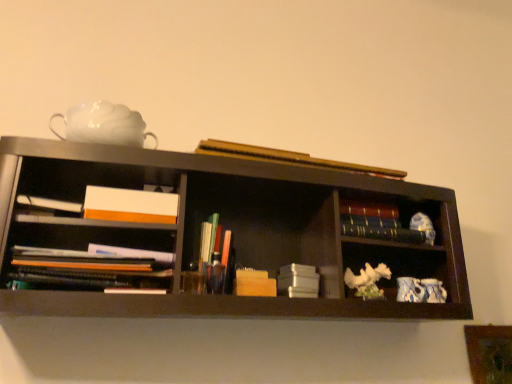
The width and height of the screenshot is (512, 384). What do you see at coordinates (388, 233) in the screenshot?
I see `dark blue hardcover book at center right, placed as the 6th book when sorted from left to right` at bounding box center [388, 233].

The width and height of the screenshot is (512, 384). Identify the location of wooden picture frame at lower right. (489, 353).

This screenshot has width=512, height=384. Describe the element at coordinates (489, 353) in the screenshot. I see `wooden picture frame at lower right` at that location.

Find the location of a particular element. blue and white porcelain teapot at lower right is located at coordinates (420, 290).

Measure the distance between blue and white porcelain teapot at lower right and camera.

blue and white porcelain teapot at lower right and camera are 4.10 feet apart from each other.

What is the approximate width of hardcover book at upper center, which is the 2th book in right-to-left order?

The width of hardcover book at upper center, which is the 2th book in right-to-left order, is 3.11 inches.

Measure the distance between white matte teapot at upper left and camera.

The distance of white matte teapot at upper left from camera is 3.66 feet.

Describe the element at coordinates (213, 254) in the screenshot. I see `matte plastic pens at center, arranged as the 2th book when viewed from the left` at that location.

Based on the photo, how much space does matte plastic pens at center, arranged as the 2th book when viewed from the left, occupy horizontally?

The width of matte plastic pens at center, arranged as the 2th book when viewed from the left, is 2.94 inches.

Identify the location of dark blue hardcover book at center right, acting as the first book starting from the right. This screenshot has width=512, height=384. (388, 233).

Are hardcover book at upper center, which is the 2th book in right-to-left order, and wooden picture frame at lower right beside each other?

No, hardcover book at upper center, which is the 2th book in right-to-left order, is not touching wooden picture frame at lower right.

How many degrees apart are the facing directions of hardcover book at upper center, which is counted as the 5th book, starting from the left, and wooden picture frame at lower right?

The facing directions of hardcover book at upper center, which is counted as the 5th book, starting from the left, and wooden picture frame at lower right are 4.2 degrees apart.

Is hardcover book at upper center, which is counted as the 5th book, starting from the left, positioned in front of wooden picture frame at lower right?

Yes, hardcover book at upper center, which is counted as the 5th book, starting from the left, is closer to the viewer.

Measure the distance between hardcover book at upper center, which is the 2th book in right-to-left order, and wooden picture frame at lower right.

hardcover book at upper center, which is the 2th book in right-to-left order, is 87.79 centimeters away from wooden picture frame at lower right.

Does hardcover book at upper center, which is counted as the 5th book, starting from the left, have a greater width compared to dark blue hardcover book at center right, placed as the 6th book when sorted from left to right?

Yes.

From the image's perspective, which one is positioned lower, hardcover book at upper center, which is the 2th book in right-to-left order, or dark blue hardcover book at center right, acting as the first book starting from the right?

From the image's view, dark blue hardcover book at center right, acting as the first book starting from the right, is below.

Based on their positions, is hardcover book at upper center, which is the 2th book in right-to-left order, located to the left or right of dark blue hardcover book at center right, acting as the first book starting from the right?

In the image, hardcover book at upper center, which is the 2th book in right-to-left order, appears on the left side of dark blue hardcover book at center right, acting as the first book starting from the right.

Who is taller, blue and white porcelain teapot at lower right or matte black books at left, the 1th book positioned from the left?

matte black books at left, the 1th book positioned from the left.

From a real-world perspective, is blue and white porcelain teapot at lower right below matte black books at left, arranged as the 6th book when viewed from the right?

Indeed, from a real-world perspective, blue and white porcelain teapot at lower right is positioned beneath matte black books at left, arranged as the 6th book when viewed from the right.

Looking at this image, does blue and white porcelain teapot at lower right turn towards matte black books at left, the 1th book positioned from the left?

No, blue and white porcelain teapot at lower right is not aimed at matte black books at left, the 1th book positioned from the left.

Consider the image. From the image's perspective, does white matte teapot at upper left appear lower than matte black books at left, the 1th book positioned from the left?

No, from the image's perspective, white matte teapot at upper left is not beneath matte black books at left, the 1th book positioned from the left.

Considering the positions of points (104, 119) and (60, 269), is point (104, 119) closer to camera compared to point (60, 269)?

No, (104, 119) is further to viewer.

Can you confirm if white matte teapot at upper left is positioned to the left of matte black books at left, the 1th book positioned from the left?

Correct, you'll find white matte teapot at upper left to the left of matte black books at left, the 1th book positioned from the left.

Identify the location of tea pot above the matte black books at left, the 1th book positioned from the left (from the image's perspective). The height and width of the screenshot is (384, 512). (103, 125).

From a real-world perspective, is white matte stack of books at center, placed as the third book when sorted from right to left, physically located above or below matte black books at left, arranged as the 6th book when viewed from the right?

From a real-world perspective, white matte stack of books at center, placed as the third book when sorted from right to left, is physically below matte black books at left, arranged as the 6th book when viewed from the right.

Would you say white matte stack of books at center, placed as the third book when sorted from right to left, is to the left or to the right of matte black books at left, the 1th book positioned from the left, in the picture?

From the image, it's evident that white matte stack of books at center, placed as the third book when sorted from right to left, is to the right of matte black books at left, the 1th book positioned from the left.

Is white matte stack of books at center, which appears as the fourth book when viewed from the left, oriented towards matte black books at left, the 1th book positioned from the left?

No, white matte stack of books at center, which appears as the fourth book when viewed from the left, is not turned towards matte black books at left, the 1th book positioned from the left.

Image resolution: width=512 pixels, height=384 pixels. I want to click on the 4th book behind the matte black books at left, arranged as the 6th book when viewed from the right, so click(298, 281).

Between dark blue hardcover book at center right, placed as the 6th book when sorted from left to right, and wooden picture frame at lower right, which one has more height?

wooden picture frame at lower right.

From the image's perspective, would you say dark blue hardcover book at center right, placed as the 6th book when sorted from left to right, is positioned over wooden picture frame at lower right?

Indeed, from the image's perspective, dark blue hardcover book at center right, placed as the 6th book when sorted from left to right, is shown above wooden picture frame at lower right.

From a real-world perspective, is dark blue hardcover book at center right, acting as the first book starting from the right, physically below wooden picture frame at lower right?

Actually, dark blue hardcover book at center right, acting as the first book starting from the right, is physically above wooden picture frame at lower right in the real world.

Which of these two, dark blue hardcover book at center right, placed as the 6th book when sorted from left to right, or wooden picture frame at lower right, is wider?

dark blue hardcover book at center right, placed as the 6th book when sorted from left to right, is wider.

How many degrees apart are the facing directions of dark blue hardcover book at center right, acting as the first book starting from the right, and matte plastic pens at center, the fifth book positioned from the right?

They differ by 0.00153 degrees in their facing directions.

Considering the relative sizes of dark blue hardcover book at center right, acting as the first book starting from the right, and matte plastic pens at center, the fifth book positioned from the right, in the image provided, is dark blue hardcover book at center right, acting as the first book starting from the right, wider than matte plastic pens at center, the fifth book positioned from the right,?

No.

How much distance is there between dark blue hardcover book at center right, placed as the 6th book when sorted from left to right, and matte plastic pens at center, the fifth book positioned from the right?

dark blue hardcover book at center right, placed as the 6th book when sorted from left to right, is 17.31 inches away from matte plastic pens at center, the fifth book positioned from the right.

Between dark blue hardcover book at center right, acting as the first book starting from the right, and matte plastic pens at center, the fifth book positioned from the right, which one has larger size?

Bigger between the two is matte plastic pens at center, the fifth book positioned from the right.

From the image's perspective, starting from the wooden picture frame at lower right, which book is the 6th one above? Please provide its 2D coordinates.

[(290, 158)]

Where is `book that is the 4th object located in front of the dark blue hardcover book at center right, acting as the first book starting from the right`? This screenshot has width=512, height=384. book that is the 4th object located in front of the dark blue hardcover book at center right, acting as the first book starting from the right is located at coordinates pos(290,158).

Looking at the image, which one is located closer to matte black books at left, the 1th book positioned from the left, wooden picture frame at lower right or wooden block at center, marked as the fourth book in a right-to-left arrangement?

wooden block at center, marked as the fourth book in a right-to-left arrangement, is positioned closer to the anchor matte black books at left, the 1th book positioned from the left.

Looking at the image, which one is located closer to white matte teapot at upper left, dark blue hardcover book at center right, placed as the 6th book when sorted from left to right, or matte black books at left, the 1th book positioned from the left?

The object closer to white matte teapot at upper left is matte black books at left, the 1th book positioned from the left.

Which object lies further to the anchor point matte plastic pens at center, arranged as the 2th book when viewed from the left, hardcover book at upper center, which is counted as the 5th book, starting from the left, or matte black books at left, arranged as the 6th book when viewed from the right?

Based on the image, hardcover book at upper center, which is counted as the 5th book, starting from the left, appears to be further to matte plastic pens at center, arranged as the 2th book when viewed from the left.

Consider the image. From the image, which object appears to be nearer to blue and white porcelain teapot at lower right, white matte teapot at upper left or hardcover book at upper center, which is counted as the 5th book, starting from the left?

The object closer to blue and white porcelain teapot at lower right is hardcover book at upper center, which is counted as the 5th book, starting from the left.

Considering their positions, is hardcover book at upper center, which is the 2th book in right-to-left order, positioned further to wooden picture frame at lower right than white matte stack of books at center, placed as the third book when sorted from right to left?

Among the two, hardcover book at upper center, which is the 2th book in right-to-left order, is located further to wooden picture frame at lower right.

When comparing their distances from dark blue hardcover book at center right, acting as the first book starting from the right, does hardcover book at upper center, which is the 2th book in right-to-left order, or matte plastic pens at center, the fifth book positioned from the right, seem further?

matte plastic pens at center, the fifth book positioned from the right, lies further to dark blue hardcover book at center right, acting as the first book starting from the right, than the other object.

Based on their spatial positions, is blue and white porcelain teapot at lower right or wooden block at center, the third book positioned from the left, closer to white matte stack of books at center, placed as the third book when sorted from right to left?

wooden block at center, the third book positioned from the left, lies closer to white matte stack of books at center, placed as the third book when sorted from right to left, than the other object.

From the image, which object appears to be farther from matte black books at left, arranged as the 6th book when viewed from the right, wooden picture frame at lower right or white matte teapot at upper left?

wooden picture frame at lower right lies further to matte black books at left, arranged as the 6th book when viewed from the right, than the other object.

The height and width of the screenshot is (384, 512). I want to click on tea set between hardcover book at upper center, which is the 2th book in right-to-left order, and wooden picture frame at lower right from top to bottom, so click(x=420, y=290).

You are a GUI agent. You are given a task and a screenshot of the screen. Output one action in this format:
    pyautogui.click(x=<x>, y=<y>)
    Task: Click on the tea set between dark blue hardcover book at center right, placed as the 6th book when sorted from left to right, and wooden picture frame at lower right vertically
    
    Given the screenshot: What is the action you would take?
    420,290

The height and width of the screenshot is (384, 512). What are the coordinates of `tea set located between white matte stack of books at center, placed as the third book when sorted from right to left, and wooden picture frame at lower right in the left-right direction` in the screenshot? It's located at (420, 290).

The width and height of the screenshot is (512, 384). I want to click on tea set between matte black books at left, the 1th book positioned from the left, and wooden picture frame at lower right, so click(420, 290).